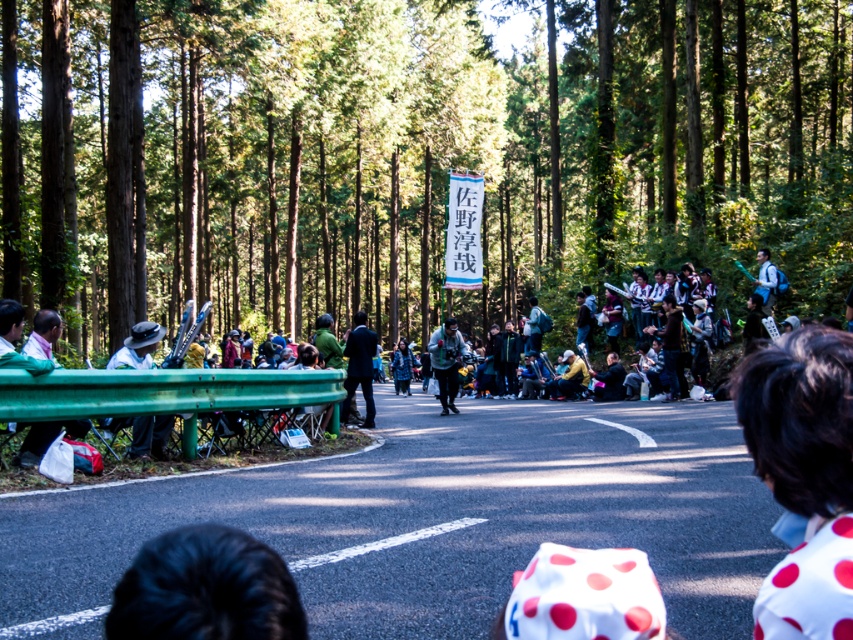
Can you confirm if white dotted shirt at lower right is wider than white matte hat at left?

In fact, white dotted shirt at lower right might be narrower than white matte hat at left.

Who is positioned more to the left, white dotted shirt at lower right or white matte hat at left?

white matte hat at left is more to the left.

Between point (804, 460) and point (144, 429), which one is positioned in front?

Positioned in front is point (804, 460).

I want to click on white dotted shirt at lower right, so click(804, 476).

Who is more distant from viewer, (149, 596) or (766, 256)?

Positioned behind is point (766, 256).

This screenshot has width=853, height=640. What do you see at coordinates (206, 589) in the screenshot? I see `black hair at lower left` at bounding box center [206, 589].

You are a GUI agent. You are given a task and a screenshot of the screen. Output one action in this format:
    pyautogui.click(x=<x>, y=<y>)
    Task: Click on the black hair at lower left
    This screenshot has height=640, width=853.
    Given the screenshot: What is the action you would take?
    pyautogui.click(x=206, y=589)

You are a GUI agent. You are given a task and a screenshot of the screen. Output one action in this format:
    pyautogui.click(x=<x>, y=<y>)
    Task: Click on the black hair at lower left
    The width and height of the screenshot is (853, 640).
    Given the screenshot: What is the action you would take?
    pyautogui.click(x=206, y=589)

Which of these two, white polka dot fabric at center or matte black camera at center, stands taller?

matte black camera at center

Is the position of white polka dot fabric at center less distant than that of matte black camera at center?

Yes.

What are the coordinates of `white polka dot fabric at center` in the screenshot? It's located at (584, 595).